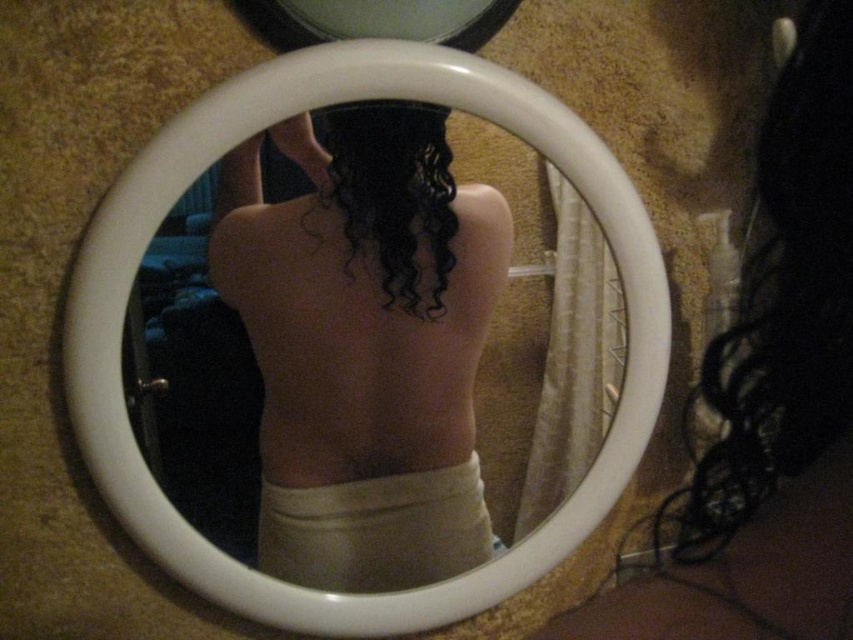
You are standing in a room and see the white plastic mirror at center and the curly dark brown hair at center in a mirror reflection. Which object is positioned to the left side in the reflection?

The white plastic mirror at center is to the left of curly dark brown hair at center in the reflection.

Looking at this image, you are standing in a room with a circular mirror on the carpet. You see two points reflected in the mirror, one at coordinates point (347, 349) and another at point (508, 592). Which point is closer to you in the reflection?

Point (347, 349) is in front of point (508, 592) in the mirror reflection, so it is closer to you.

You are a hairstylist trying to style two sections of hair in the reflection. The black curly hair at upper right and the curly dark brown hair at center are both visible in the mirror. Can you determine if there is enough space between them to insert a 10 inch wide comb?

The black curly hair at upper right is 10.78 inches away from the curly dark brown hair at center. Since the distance between them is greater than 10 inches, the comb can fit between them.